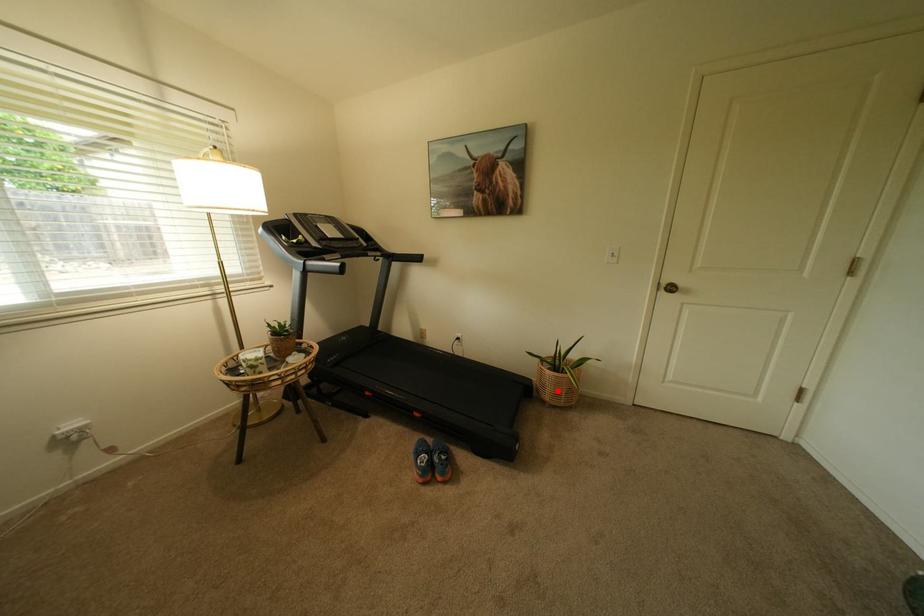
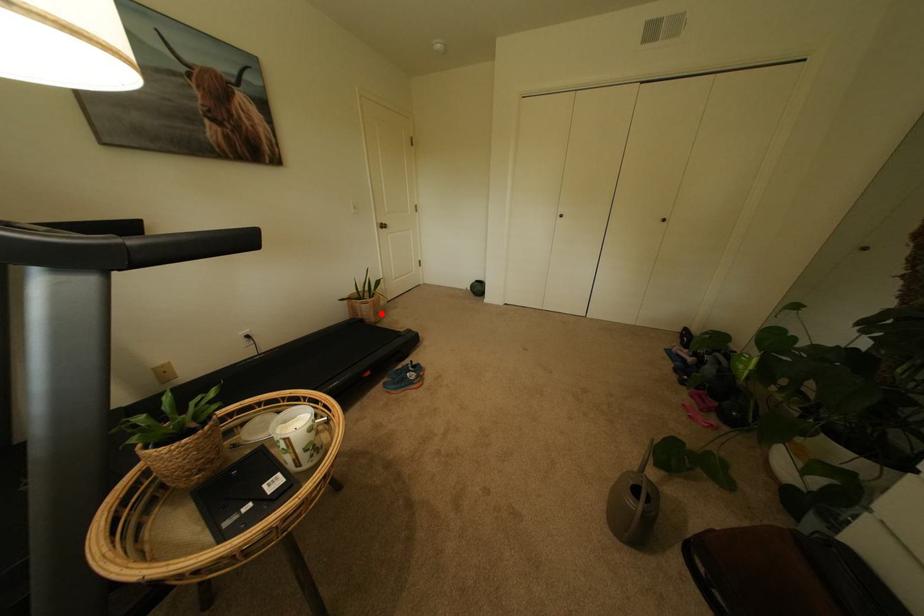
I am providing you with two images of the same scene from different viewpoints. A red point is marked on the first image and another point is marked on the second image. Are the points marked in image1 and image2 representing the same 3D position?

Yes